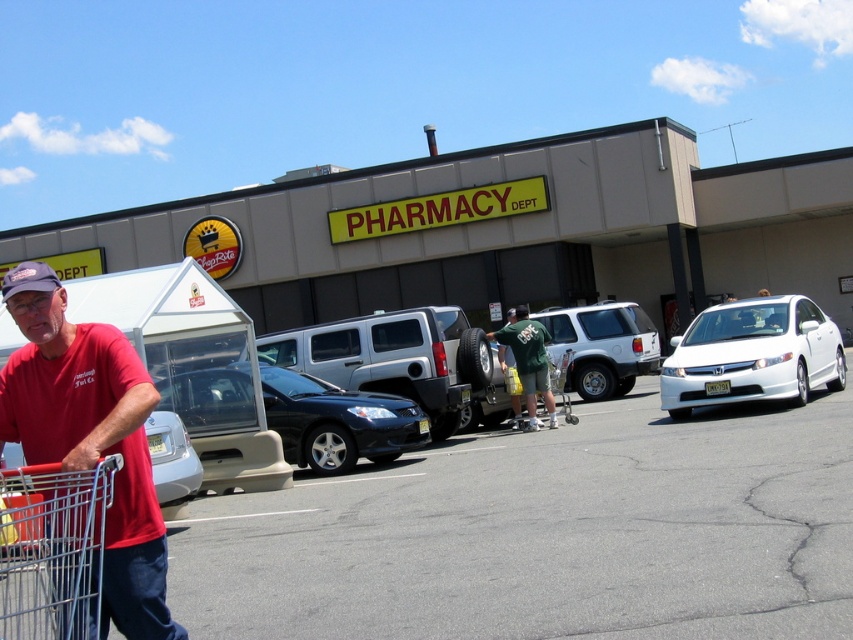
Between metallic silver shopping cart at lower left and white matte suv at center, which one has more height?

white matte suv at center is taller.

Does metallic silver shopping cart at lower left appear on the left side of white matte suv at center?

Correct, you'll find metallic silver shopping cart at lower left to the left of white matte suv at center.

Locate an element on the screen. metallic silver shopping cart at lower left is located at coordinates (51, 548).

Between shiny black sedan at center and white matte suv at center, which one has more height?

white matte suv at center

The width and height of the screenshot is (853, 640). Describe the element at coordinates (337, 420) in the screenshot. I see `shiny black sedan at center` at that location.

What are the coordinates of `shiny black sedan at center` in the screenshot? It's located at (337, 420).

Is the position of gray asphalt parking lot at center more distant than that of shiny black sedan at center?

No, it is in front of shiny black sedan at center.

Does point (117, 636) come in front of point (375, 433)?

Yes, it is in front of point (375, 433).

The width and height of the screenshot is (853, 640). Identify the location of gray asphalt parking lot at center. (547, 534).

Find the location of a particular element. gray asphalt parking lot at center is located at coordinates (547, 534).